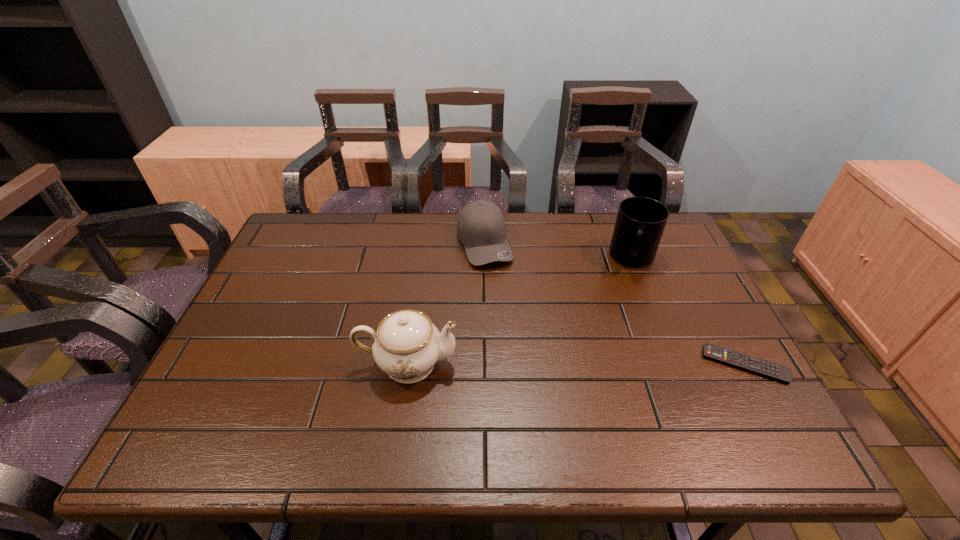
Image resolution: width=960 pixels, height=540 pixels. I want to click on vacant space on the desktop that is between the chinaware and the rightmost object and is positioned on the side of the second object from right to left with the handle, so click(616, 364).

Find the location of `vacant spot on the desktop that is between the chinaware and the shortest object and is positioned on the front brim of the second shortest object`. vacant spot on the desktop that is between the chinaware and the shortest object and is positioned on the front brim of the second shortest object is located at coordinates (540, 364).